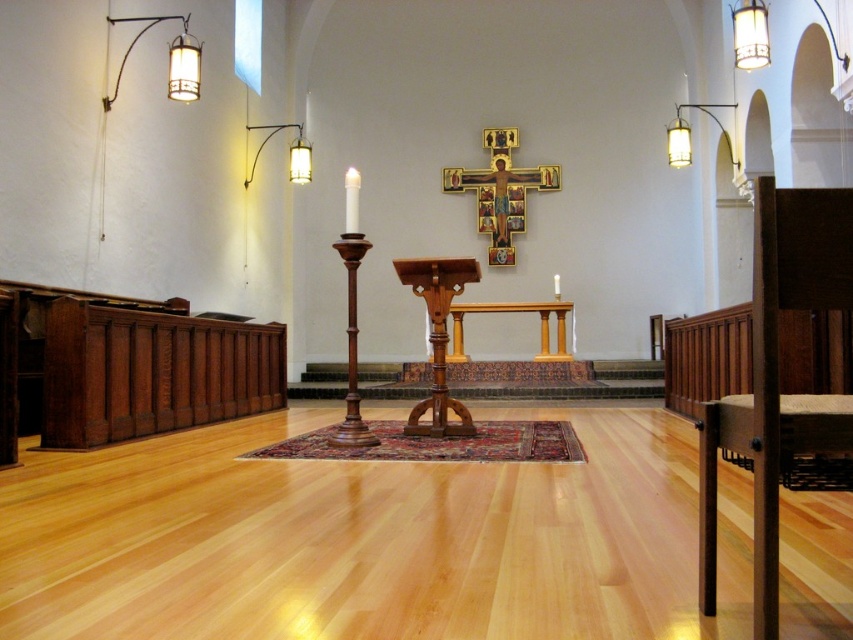
You are standing in the church and want to determine which of the two points, point (x=190, y=52) or point (x=306, y=145), is nearer to you. Based on the scene description, which point is closer?

Point (x=190, y=52) is closer to the viewer than point (x=306, y=145).

You are standing in the church and want to place a bouquet of flowers on the wooden altar at center. According to the image, where exactly should you place the bouquet?

The wooden altar at center is located at point (514, 310), so you should place the bouquet there.